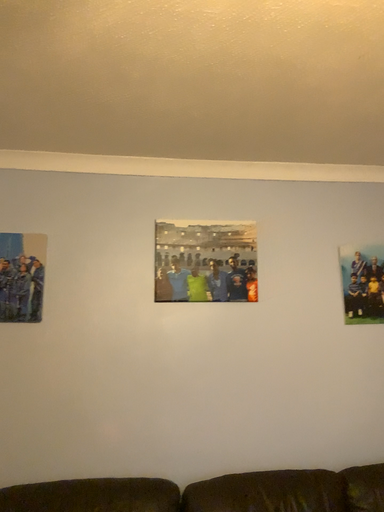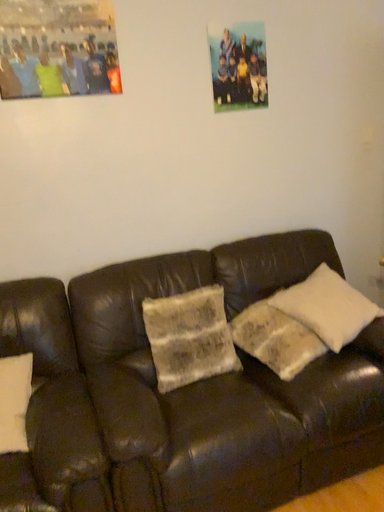
Question: Which way did the camera rotate in the video?

Choices:
 (A) rotated right
 (B) rotated left

Answer: (A)